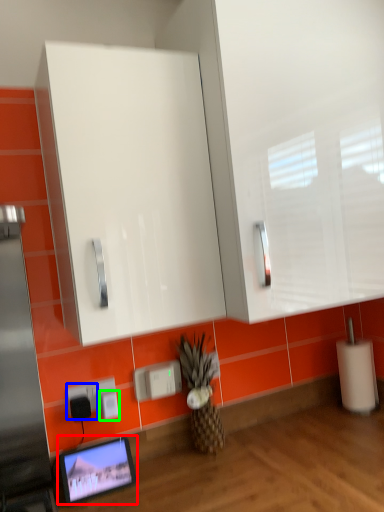
Question: Based on their relative distances, which object is nearer to computer monitor (highlighted by a red box)? Choose from electric outlet (highlighted by a blue box) and electric outlet (highlighted by a green box).

Choices:
 (A) electric outlet
 (B) electric outlet

Answer: (A)